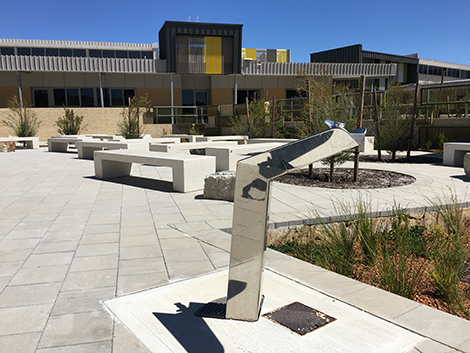
The width and height of the screenshot is (470, 353). I want to click on windows, so click(x=38, y=96), click(x=65, y=96), click(x=87, y=94), click(x=120, y=94), click(x=196, y=98), click(x=247, y=98), click(x=295, y=97).